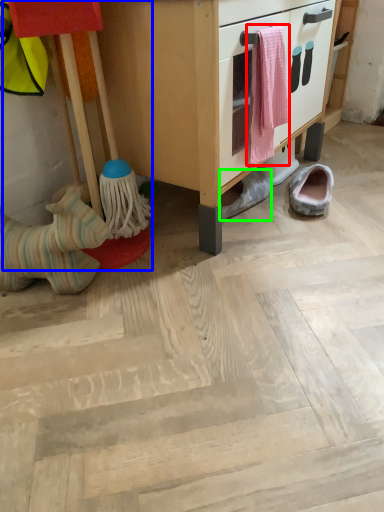
Question: Based on their relative distances, which object is nearer to laundry (highlighted by a red box)? Choose from toy (highlighted by a blue box) and footwear (highlighted by a green box).

Choices:
 (A) toy
 (B) footwear

Answer: (B)